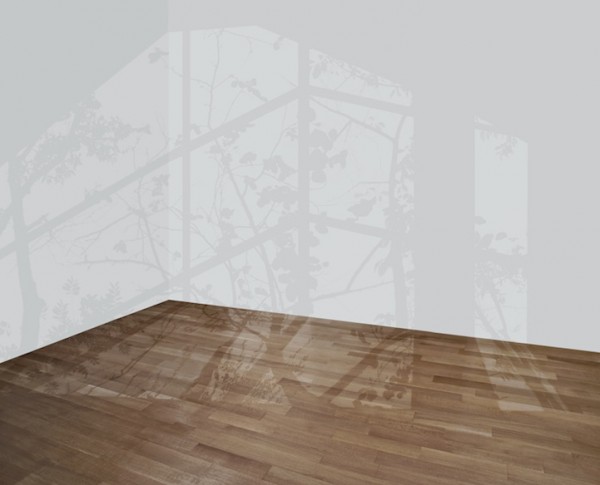
The height and width of the screenshot is (485, 600). Find the location of `reflection from window on right wall`. reflection from window on right wall is located at coordinates (355, 192).